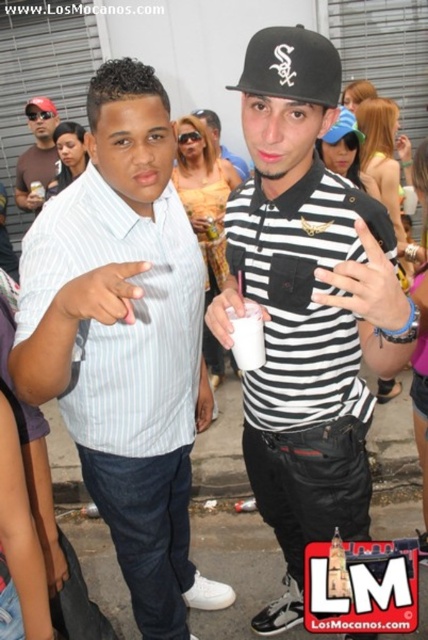
Who is positioned more to the left, white paper cup at center or white plastic cup at center?

From the viewer's perspective, white plastic cup at center appears more on the left side.

Can you confirm if white paper cup at center is positioned to the left of white plastic cup at center?

In fact, white paper cup at center is to the right of white plastic cup at center.

This screenshot has width=428, height=640. Find the location of `white paper cup at center`. white paper cup at center is located at coordinates (247, 337).

Can you confirm if white striped shirt at left is thinner than matte black polo shirt at center?

Incorrect, white striped shirt at left's width is not less than matte black polo shirt at center's.

Is white striped shirt at left shorter than matte black polo shirt at center?

No, white striped shirt at left is not shorter than matte black polo shirt at center.

This screenshot has height=640, width=428. What are the coordinates of `white striped shirt at left` in the screenshot? It's located at (118, 321).

Is point (276, 45) less distant than point (38, 132)?

That is True.

At what (x,y) coordinates should I click in order to perform the action: click on black fabric baseball cap at upper center. Please return your answer as a coordinate pair (x, y). Image resolution: width=428 pixels, height=640 pixels. Looking at the image, I should click on (291, 67).